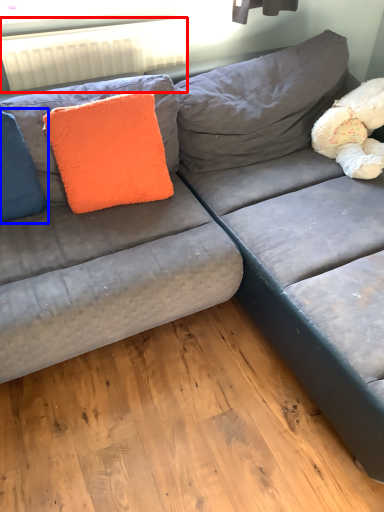
Question: Which of the following is the farthest to the observer, radiator (highlighted by a red box) or pillow (highlighted by a blue box)?

Choices:
 (A) radiator
 (B) pillow

Answer: (A)